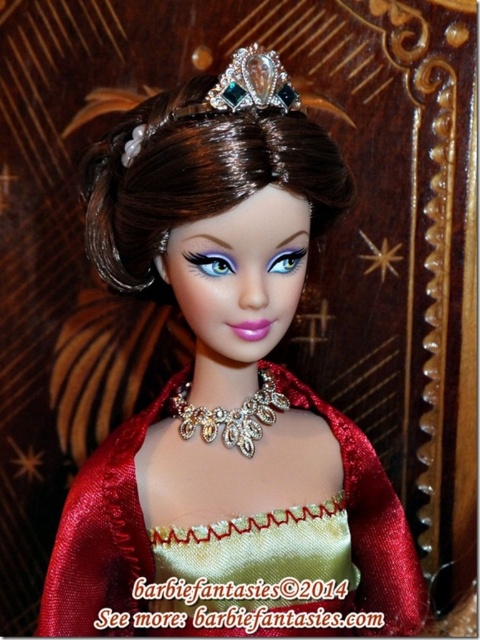
You are a fashion designer examining the doll. You need to place a new accessory between the shiny brown hair at center and the clear crystal tiara at center. Is there enough space to fit a 2.5 inch accessory between them?

The shiny brown hair at center and clear crystal tiara at center are 2.28 inches apart. Since the accessory is 2.5 inches wide, it would not fit between them as the space is smaller than the accessory.

You are a photographer adjusting the lighting for a closeup shot of the doll. You notice a point marked at coordinates point (197, 177). What is the significance of this point in relation to the doll?

The point (197, 177) marks the location of the shiny brown hair at center, which is a key feature to highlight in the lighting setup.

You are a fashion designer who wants to place a new accessory between the shiny gold fabric dress at center and the clear crystal tiara at center. The accessory is 10 inches long. Can you fit it between them without overlapping either?

The shiny gold fabric dress at center and clear crystal tiara at center are 18.89 inches apart from each other. Since the accessory is 10 inches long, there is enough space between them to fit it without overlapping either.